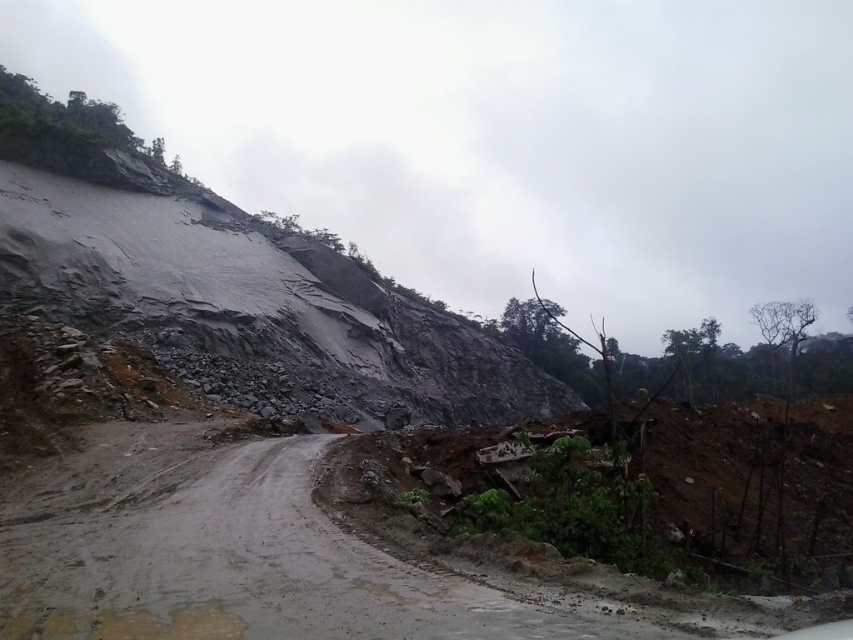
Does muddy concrete dirt track at center appear under gray rock at upper left?

Correct, muddy concrete dirt track at center is located below gray rock at upper left.

Which is below, muddy concrete dirt track at center or gray rock at upper left?

Positioned lower is muddy concrete dirt track at center.

Where is `muddy concrete dirt track at center`? The height and width of the screenshot is (640, 853). muddy concrete dirt track at center is located at coordinates (236, 556).

The width and height of the screenshot is (853, 640). Find the location of `muddy concrete dirt track at center`. muddy concrete dirt track at center is located at coordinates (236, 556).